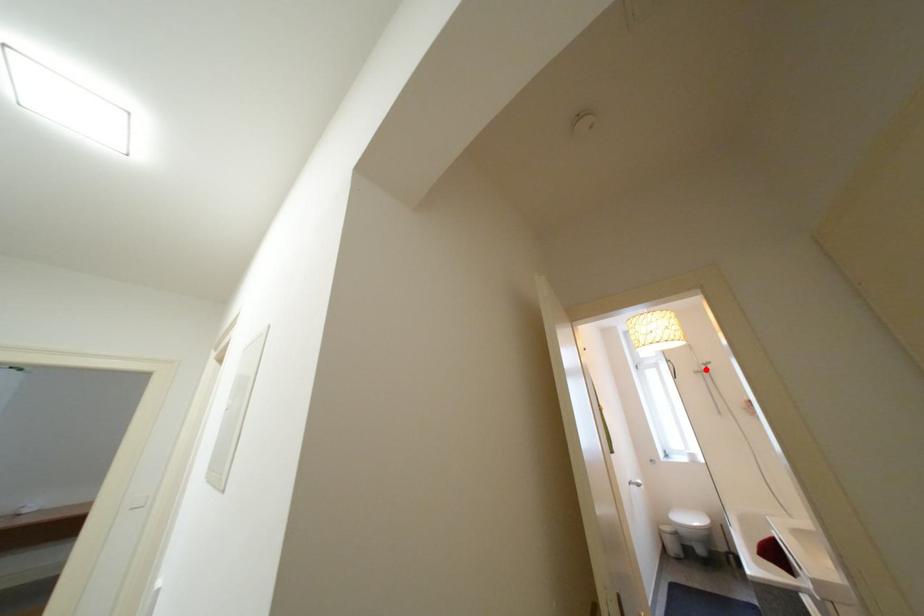
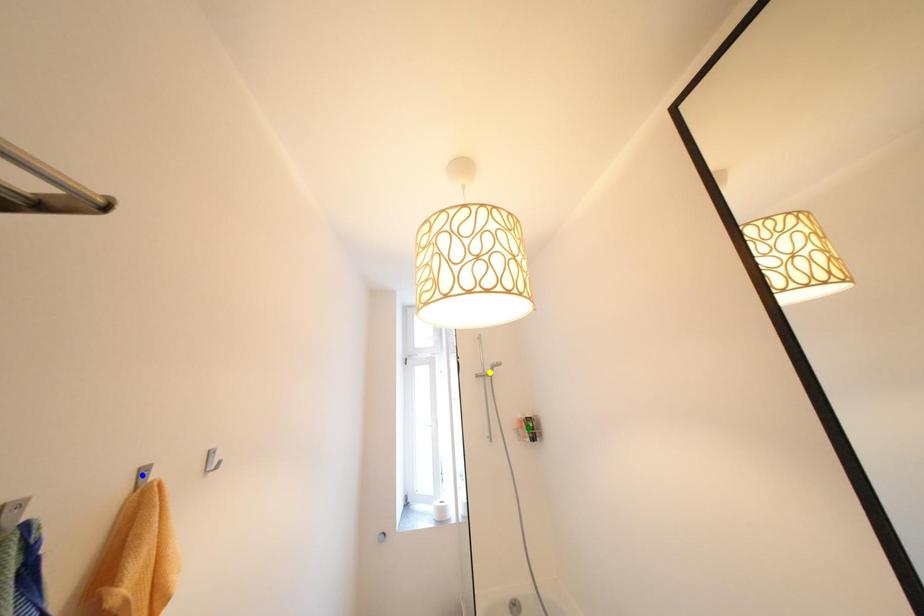
Question: I am providing you with two images of the same scene from different viewpoints. A red point is marked on the first image. You are given multiple points on the second image. Which spot in image 2 lines up with the point in image 1?

Choices:
 (A) blue point
 (B) yellow point
 (C) green point

Answer: (B)